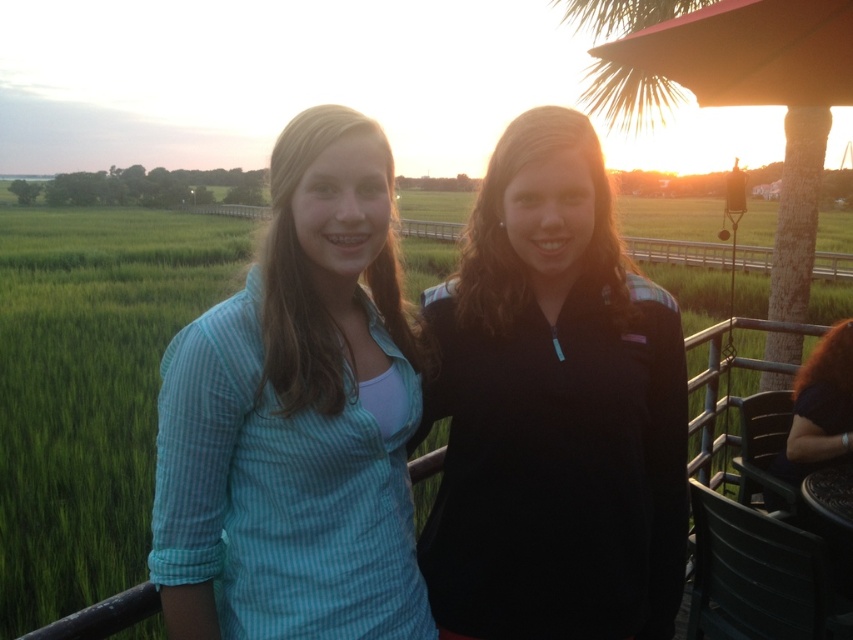
You are planning to take a photo of the black fleece jacket at center and the green grass at center. Which object will appear smaller in the photo?

The black fleece jacket at center will appear smaller in the photo because it occupies less space than the green grass at center according to the description.

You are standing at the origin point in the image. The teal striped shirt at center is located at point (296, 417). Which direction should you move to reach the teal striped shirt at center?

The teal striped shirt at center is located at point (296, 417), so you should move northeast to reach it.